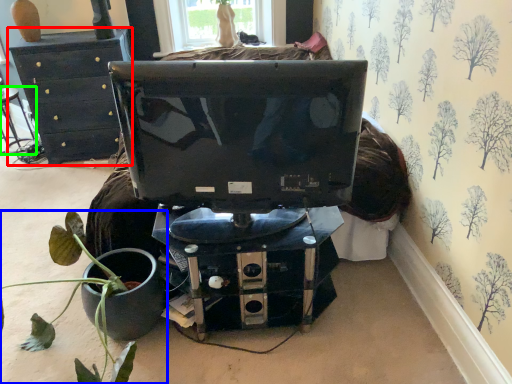
Question: Estimate the real-world distances between objects in this image. Which object is closer to furniture (highlighted by a red box), houseplant (highlighted by a blue box) or chair (highlighted by a green box)?

Choices:
 (A) houseplant
 (B) chair

Answer: (B)